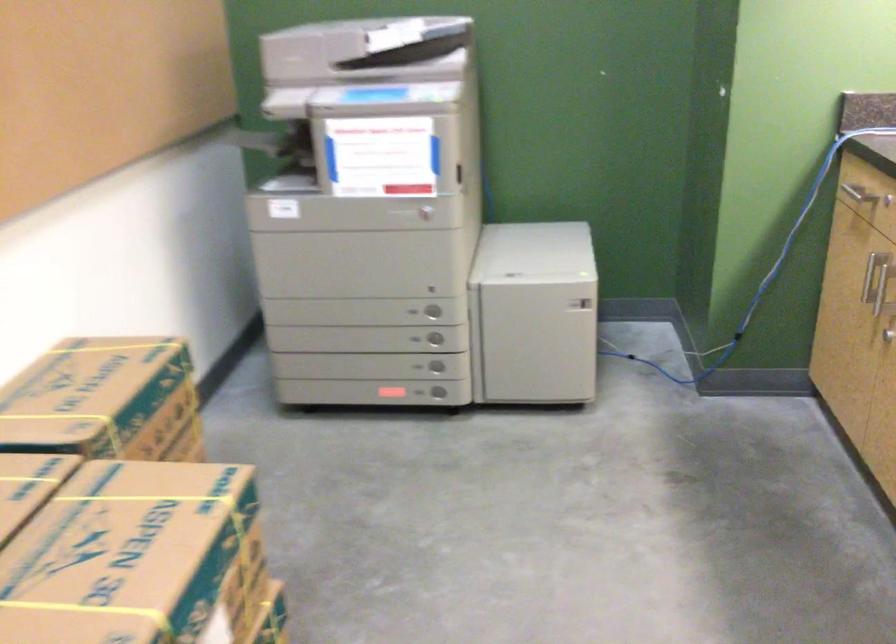
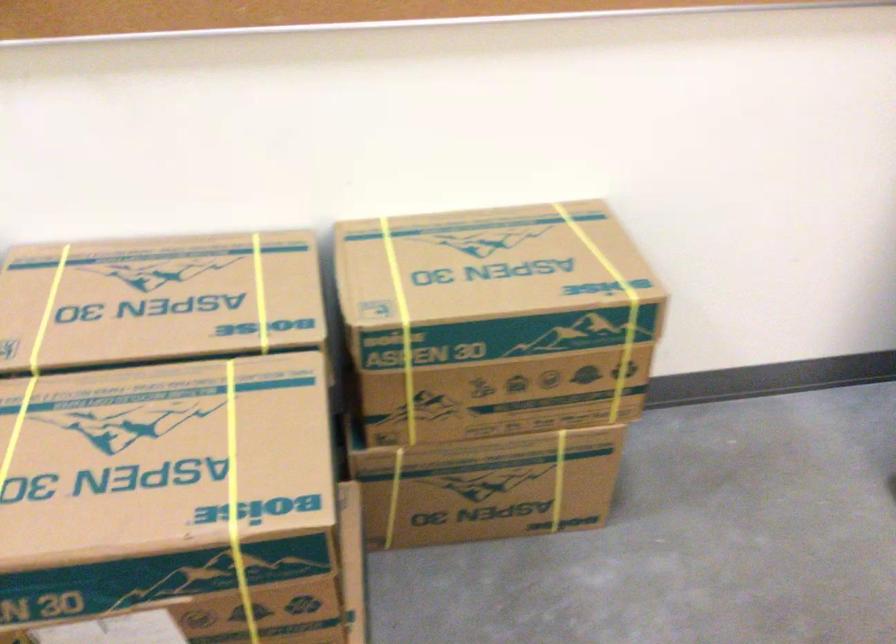
The point at [112,426] is marked in the first image. Where is the corresponding point in the second image?

(401, 327)